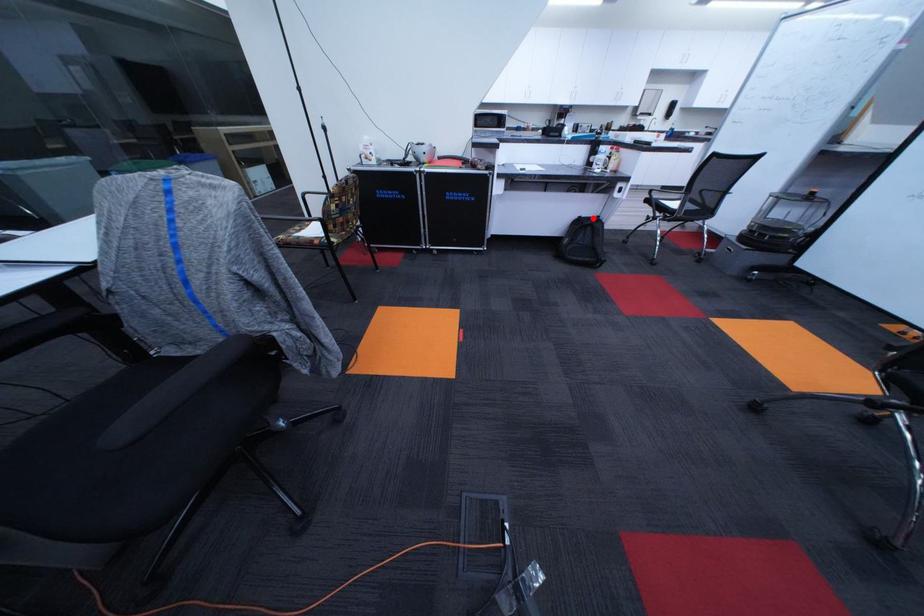
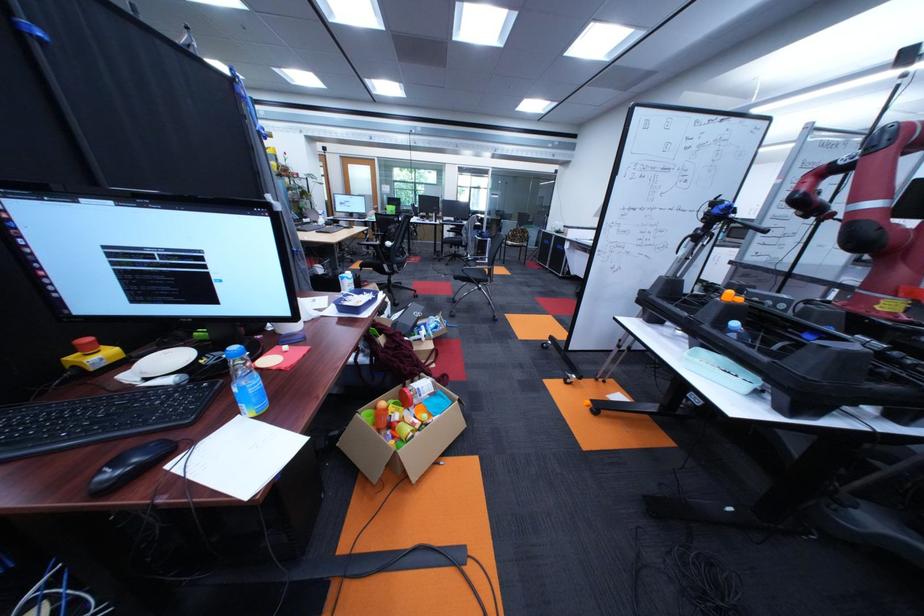
Question: I am providing you with two images of the same scene from different viewpoints. A red point is marked on the first image. Can you still see the location of the red point in image 2?

Choices:
 (A) Yes
 (B) No

Answer: (B)